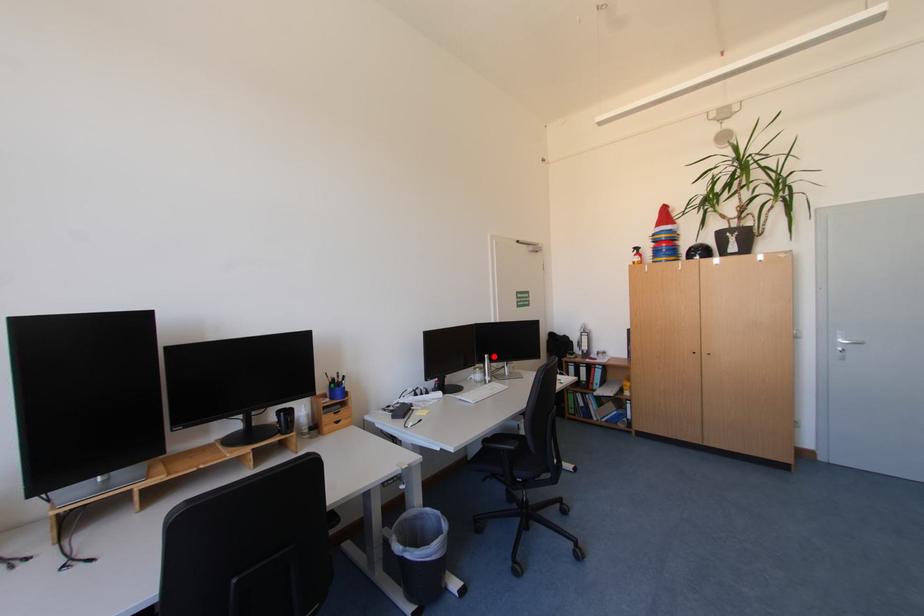
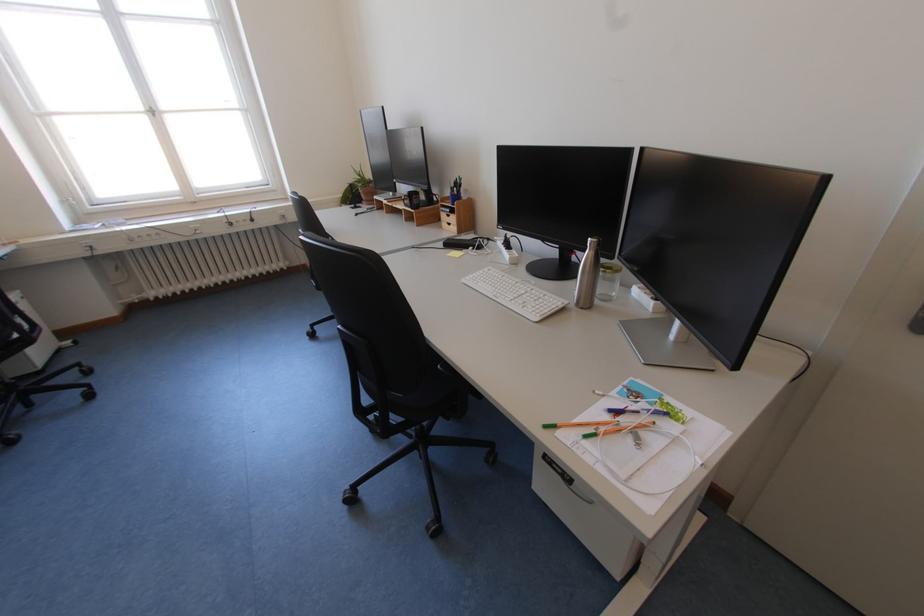
Question: I am providing you with two images of the same scene from different viewpoints. In image1, a red point is highlighted. Considering the same 3D point in image2, which of the following is correct?

Choices:
 (A) It is closer
 (B) It is farther

Answer: (A)